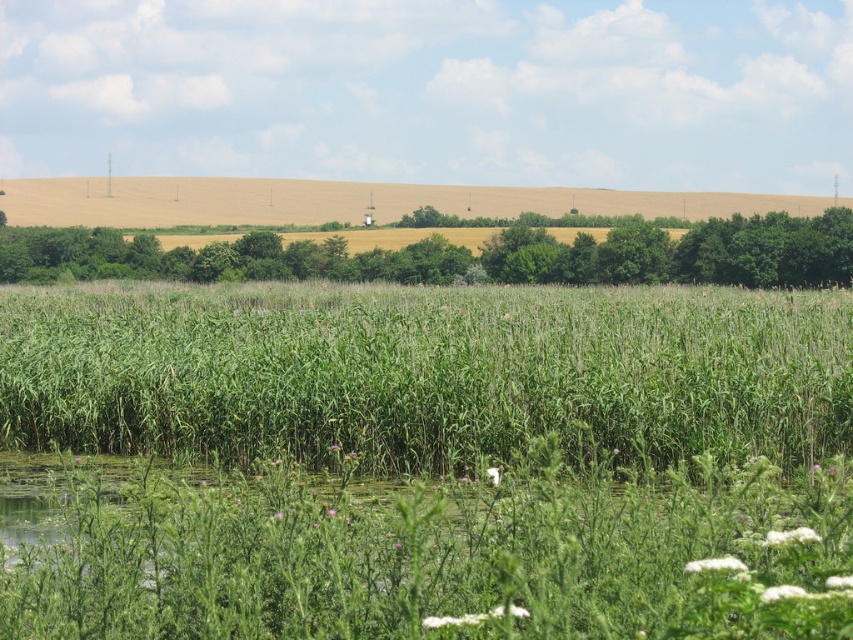
Is green grassy at center behind green leafy tree at center?

No.

This screenshot has width=853, height=640. What do you see at coordinates (424, 371) in the screenshot?
I see `green grassy at center` at bounding box center [424, 371].

Where is `green grassy at center`? The image size is (853, 640). green grassy at center is located at coordinates (424, 371).

The image size is (853, 640). What are the coordinates of `green grassy at center` in the screenshot? It's located at (424, 371).